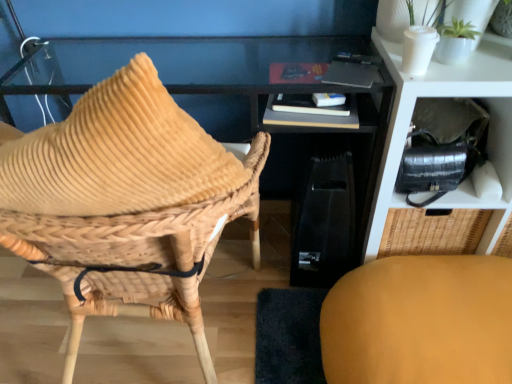
Question: Considering the relative sizes of hardcover book at center and matte yellow cushion at lower right, the first chair when ordered from right to left, in the image provided, is hardcover book at center bigger than matte yellow cushion at lower right, the first chair when ordered from right to left,?

Choices:
 (A) no
 (B) yes

Answer: (A)

Question: Considering the relative sizes of hardcover book at center and matte yellow cushion at lower right, the first chair when ordered from right to left, in the image provided, is hardcover book at center smaller than matte yellow cushion at lower right, the first chair when ordered from right to left,?

Choices:
 (A) yes
 (B) no

Answer: (A)

Question: Does hardcover book at center have a greater width compared to matte yellow cushion at lower right, positioned as the 2th chair in left-to-right order?

Choices:
 (A) no
 (B) yes

Answer: (A)

Question: Is matte yellow cushion at lower right, positioned as the 2th chair in left-to-right order, at the back of hardcover book at center?

Choices:
 (A) yes
 (B) no

Answer: (B)

Question: Can we say hardcover book at center lies outside matte yellow cushion at lower right, the first chair when ordered from right to left?

Choices:
 (A) no
 (B) yes

Answer: (B)

Question: Choose the correct answer: Is matte black shelf at upper right inside woven wood chair at left, arranged as the first chair when viewed from the left, or outside it?

Choices:
 (A) inside
 (B) outside

Answer: (B)

Question: Based on their sizes in the image, would you say matte black shelf at upper right is bigger or smaller than woven wood chair at left, arranged as the first chair when viewed from the left?

Choices:
 (A) big
 (B) small

Answer: (B)

Question: Does point (375, 253) appear closer or farther from the camera than point (99, 91)?

Choices:
 (A) closer
 (B) farther

Answer: (B)

Question: From a real-world perspective, is matte black shelf at upper right above or below woven wood chair at left, which is the second chair from right to left?

Choices:
 (A) above
 (B) below

Answer: (B)

Question: Relative to hardcover book at center, is woven wood chair at left, which is the second chair from right to left, in front or behind?

Choices:
 (A) behind
 (B) front

Answer: (B)

Question: From a real-world perspective, relative to hardcover book at center, is woven wood chair at left, which is the second chair from right to left, vertically above or below?

Choices:
 (A) below
 (B) above

Answer: (A)

Question: Is woven wood chair at left, arranged as the first chair when viewed from the left, spatially inside hardcover book at center, or outside of it?

Choices:
 (A) inside
 (B) outside

Answer: (B)

Question: Is woven wood chair at left, arranged as the first chair when viewed from the left, wider or thinner than hardcover book at center?

Choices:
 (A) thin
 (B) wide

Answer: (B)

Question: From their relative heights in the image, would you say matte yellow cushion at lower right, positioned as the 2th chair in left-to-right order, is taller or shorter than matte black shelf at upper right?

Choices:
 (A) short
 (B) tall

Answer: (A)

Question: From a real-world perspective, is matte yellow cushion at lower right, positioned as the 2th chair in left-to-right order, physically located above or below matte black shelf at upper right?

Choices:
 (A) below
 (B) above

Answer: (A)